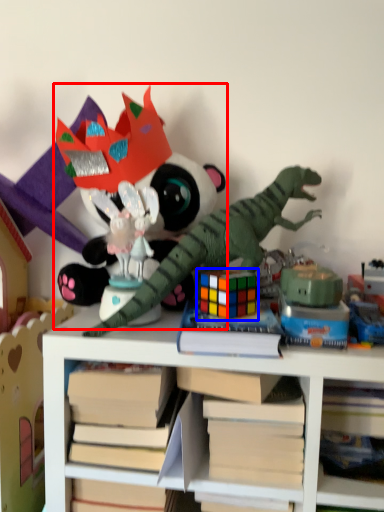
Question: Which object is closer to the camera taking this photo, toy (highlighted by a red box) or toy (highlighted by a blue box)?

Choices:
 (A) toy
 (B) toy

Answer: (B)